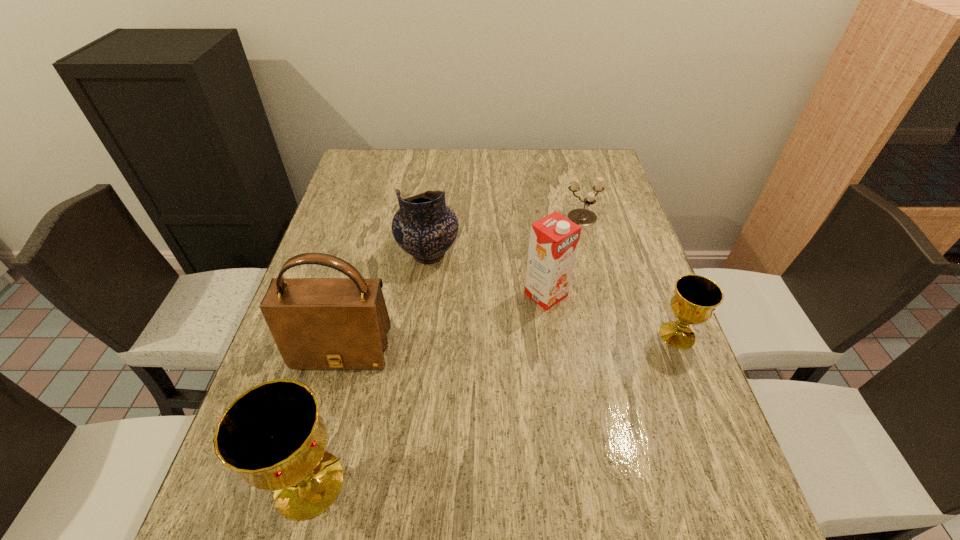
The image size is (960, 540). Find the location of `free spot between the fifth nearest object and the tallest object`. free spot between the fifth nearest object and the tallest object is located at coordinates (385, 302).

I want to click on free space that is in between the fourth nearest object and the nearer chalice, so click(x=427, y=389).

You are a GUI agent. You are given a task and a screenshot of the screen. Output one action in this format:
    pyautogui.click(x=<x>, y=<y>)
    Task: Click on the free spot between the fifth object from left to right and the taller chalice
    
    Given the screenshot: What is the action you would take?
    pyautogui.click(x=446, y=351)

Find the location of a particular element. This screenshot has width=960, height=540. free space between the right chalice and the second object from right to left is located at coordinates (630, 277).

Where is `free space between the rightmost object and the farthest object`? The height and width of the screenshot is (540, 960). free space between the rightmost object and the farthest object is located at coordinates (630, 277).

Select which object appears as the second closest to the shoulder bag. Please provide its 2D coordinates. Your answer should be formatted as a tuple, i.e. [(x, y)], where the tuple contains the x and y coordinates of a point satisfying the conditions above.

[(425, 227)]

I want to click on object that is the nearest to the fourth object from left to right, so click(x=425, y=227).

This screenshot has height=540, width=960. I want to click on free location that satisfies the following two spatial constraints: 1. on the back side of the pottery; 2. on the right side of the nearer chalice, so click(x=370, y=254).

The width and height of the screenshot is (960, 540). What are the coordinates of `vacant space that satisfies the following two spatial constraints: 1. on the front side of the candle holder; 2. on the right side of the rightmost object` in the screenshot? It's located at (614, 335).